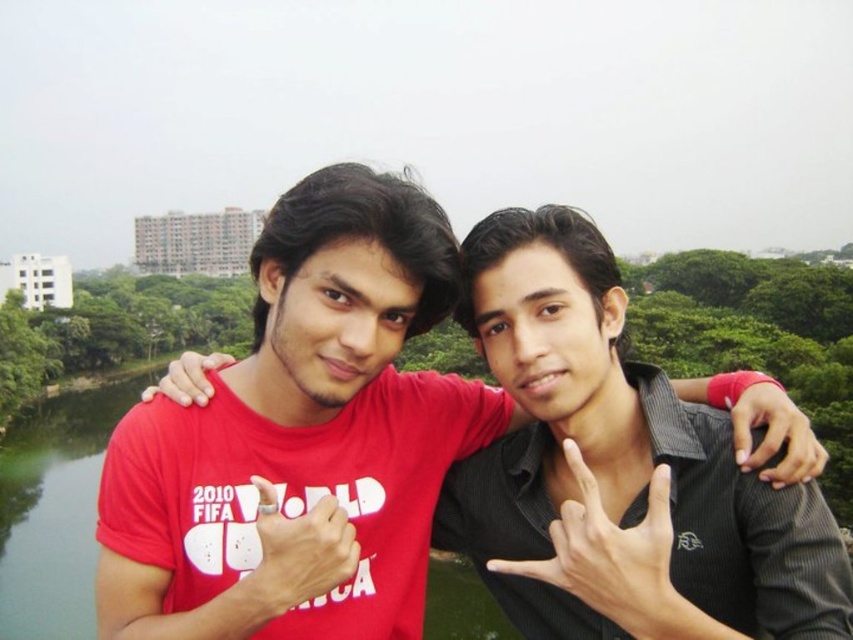
You are a photographer trying to adjust the lighting for a photo shoot. You have a spotlight that can only illuminate a circular area with a radius of 0.3 units. The center of the spotlight must be placed exactly at point (300,440). Will the spotlight cover the entire matte red tshirt at center?

The point (300,440) marks the matte red tshirt at center. Since the spotlight has a radius of 0.3 units centered at this point, it will cover the entire matte red tshirt at center as long as the tshirt fits within the circular area. However, without specific dimensions of the tshirt, we can assume the spotlight is sufficient for typical tshirt sizes.